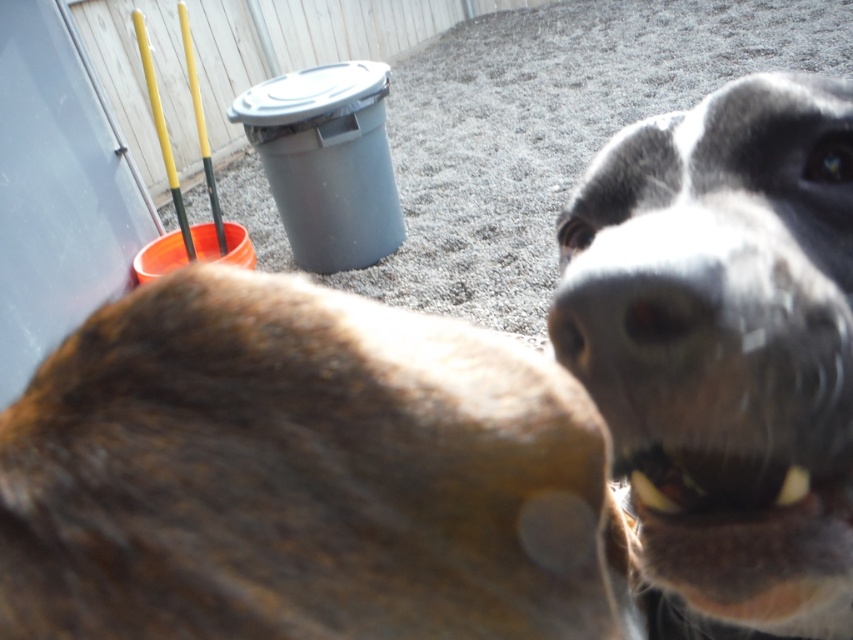
Question: Can you confirm if black fur dog at center is positioned to the left of black smooth nose at center?

Choices:
 (A) yes
 (B) no

Answer: (B)

Question: Which of the following is the closest to the observer?

Choices:
 (A) white glossy teeth at lower right
 (B) black fur dog at center
 (C) brown fur at center
 (D) black smooth nose at center

Answer: (C)

Question: Estimate the real-world distances between objects in this image. Which object is closer to the black fur dog at center?

Choices:
 (A) brown fur at center
 (B) black smooth nose at center
 (C) white glossy teeth at lower right

Answer: (C)

Question: Which point is closer to the camera?

Choices:
 (A) black smooth nose at center
 (B) black fur dog at center
 (C) brown fur at center
 (D) white glossy teeth at lower right

Answer: (C)

Question: Considering the relative positions of black fur dog at center and black smooth nose at center in the image provided, where is black fur dog at center located with respect to black smooth nose at center?

Choices:
 (A) left
 (B) right

Answer: (B)

Question: Where is black fur dog at center located in relation to white glossy teeth at lower right in the image?

Choices:
 (A) above
 (B) below

Answer: (B)